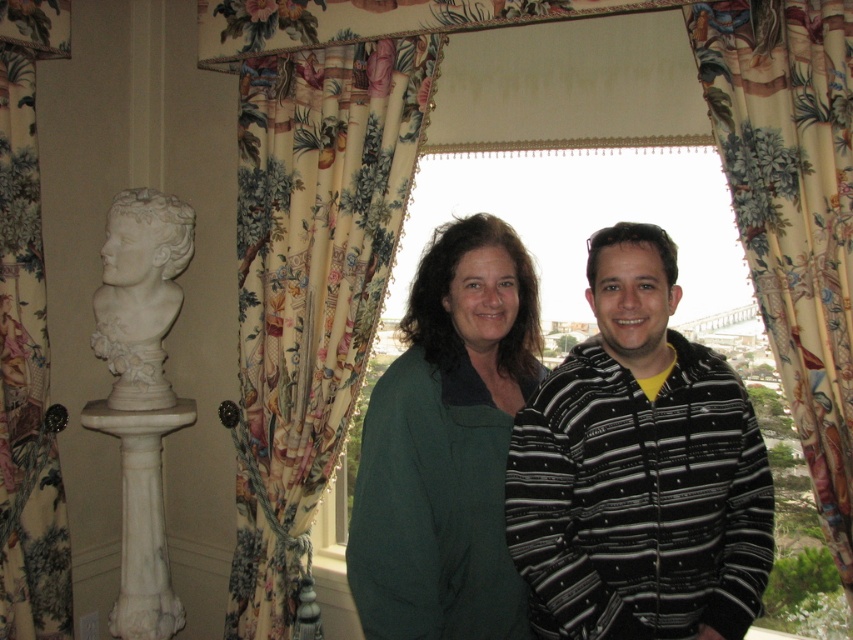
Measure the distance between floral fabric curtain at center and camera.

floral fabric curtain at center is 8.30 feet away from camera.

Who is lower down, floral fabric curtain at center or floral fabric curtain at right?

Positioned lower is floral fabric curtain at center.

This screenshot has width=853, height=640. What do you see at coordinates (310, 291) in the screenshot? I see `floral fabric curtain at center` at bounding box center [310, 291].

This screenshot has height=640, width=853. I want to click on floral fabric curtain at center, so click(x=310, y=291).

How far apart are green woolen sweater at center and floral fabric curtain at left?

The distance of green woolen sweater at center from floral fabric curtain at left is 4.93 feet.

Who is more distant from viewer, (451, 522) or (13, 19)?

The point (13, 19) is behind.

The image size is (853, 640). I want to click on green woolen sweater at center, so click(x=447, y=445).

Between dark green sweater at center and floral fabric curtain at right, which one appears on the right side from the viewer's perspective?

floral fabric curtain at right is more to the right.

Is dark green sweater at center positioned behind floral fabric curtain at right?

No.

This screenshot has width=853, height=640. What do you see at coordinates (447, 445) in the screenshot?
I see `dark green sweater at center` at bounding box center [447, 445].

You are a GUI agent. You are given a task and a screenshot of the screen. Output one action in this format:
    pyautogui.click(x=<x>, y=<y>)
    Task: Click on the dark green sweater at center
    Image resolution: width=853 pixels, height=640 pixels.
    Given the screenshot: What is the action you would take?
    pyautogui.click(x=447, y=445)